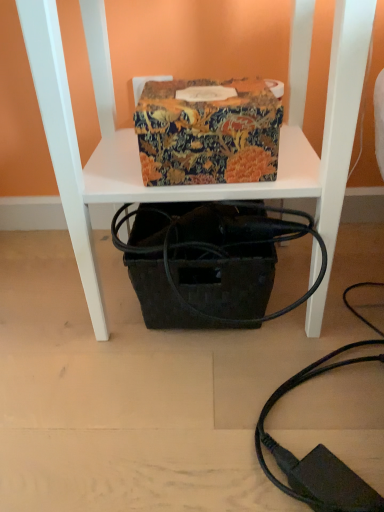
Question: Is patterned fabric box at center bigger or smaller than black woven basket at center?

Choices:
 (A) big
 (B) small

Answer: (B)

Question: From a real-world perspective, is patterned fabric box at center above or below black woven basket at center?

Choices:
 (A) below
 (B) above

Answer: (B)

Question: Which is nearer to the patterned fabric box at center?

Choices:
 (A) black woven basket at center
 (B) black woven basket at lower center

Answer: (A)

Question: Which object is positioned farthest from the black woven basket at lower center?

Choices:
 (A) black woven basket at center
 (B) patterned fabric box at center

Answer: (B)